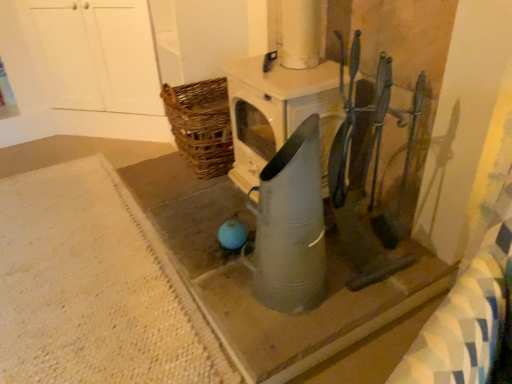
Image resolution: width=512 pixels, height=384 pixels. Identify the location of free space to the left of metallic gray watering can at center. (222, 290).